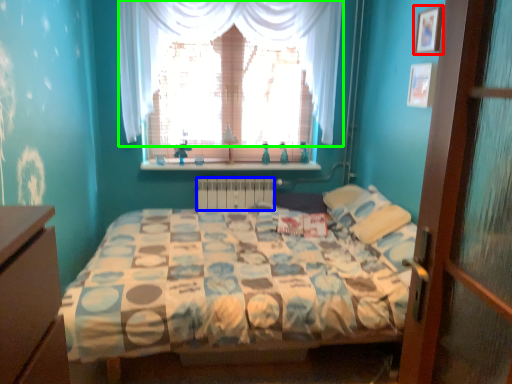
Question: Which is farther away from picture frame (highlighted by a red box)? radiator (highlighted by a blue box) or curtain (highlighted by a green box)?

Choices:
 (A) radiator
 (B) curtain

Answer: (A)